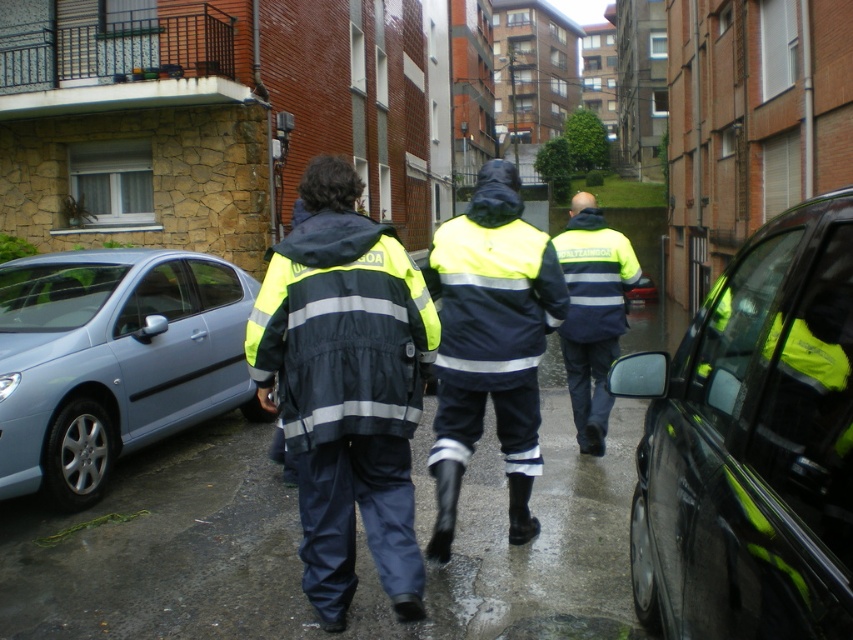
Which is in front, point (366, 387) or point (445, 296)?

Positioned in front is point (366, 387).

Is reflective yellow jacket at center to the left of high-visibility reflective jacket at center from the viewer's perspective?

Yes, reflective yellow jacket at center is to the left of high-visibility reflective jacket at center.

In order to click on reflective yellow jacket at center in this screenshot , I will do `click(346, 387)`.

From the picture: Is reflective yellow jacket at center positioned at the back of high visibility yellow jacket at center?

No, it is in front of high visibility yellow jacket at center.

Image resolution: width=853 pixels, height=640 pixels. What do you see at coordinates (346, 387) in the screenshot?
I see `reflective yellow jacket at center` at bounding box center [346, 387].

The width and height of the screenshot is (853, 640). I want to click on reflective yellow jacket at center, so click(x=346, y=387).

Where is `reflective yellow jacket at center`? Image resolution: width=853 pixels, height=640 pixels. reflective yellow jacket at center is located at coordinates (346, 387).

Is point (395, 397) positioned behind point (65, 381)?

No, it is in front of (65, 381).

From the picture: Which is more to the right, reflective yellow jacket at center or light blue metallic car at left?

reflective yellow jacket at center

You are a GUI agent. You are given a task and a screenshot of the screen. Output one action in this format:
    pyautogui.click(x=<x>, y=<y>)
    Task: Click on the reflective yellow jacket at center
    The image size is (853, 640).
    Given the screenshot: What is the action you would take?
    pyautogui.click(x=346, y=387)

The image size is (853, 640). Find the location of `reflective yellow jacket at center`. reflective yellow jacket at center is located at coordinates (346, 387).